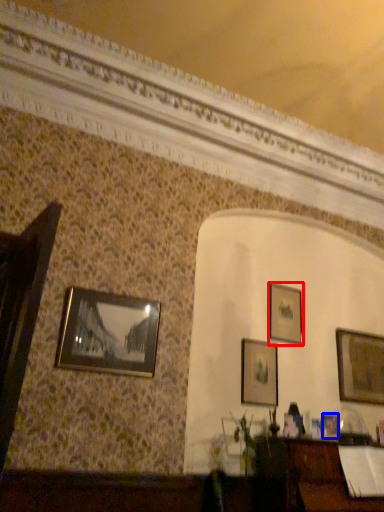
Question: Which point is closer to the camera, picture frame (highlighted by a red box) or picture frame (highlighted by a blue box)?

Choices:
 (A) picture frame
 (B) picture frame

Answer: (B)